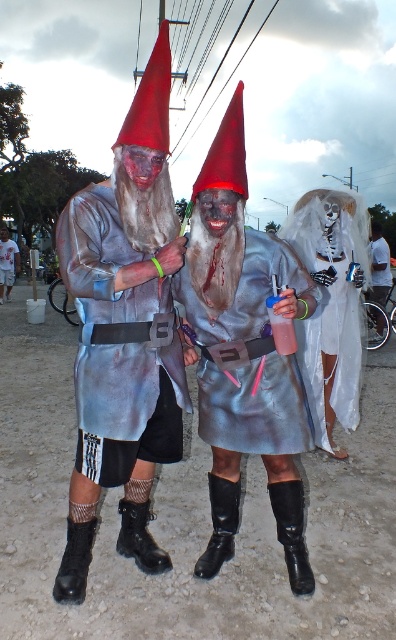
Question: Estimate the real-world distances between objects in this image. Which object is farther from the white sheer fabric ghost at center?

Choices:
 (A) matte silver costume at center
 (B) metallic silver costume at center
 (C) metallic silver dress at center
 (D) brushed silver robe at center

Answer: (B)

Question: Is brushed silver robe at center smaller than metallic silver dress at center?

Choices:
 (A) no
 (B) yes

Answer: (A)

Question: Among these points, which one is nearest to the camera?

Choices:
 (A) (260, 298)
 (B) (375, 280)
 (C) (356, 291)

Answer: (A)

Question: Among these points, which one is nearest to the camera?

Choices:
 (A) (373, 312)
 (B) (302, 275)
 (C) (234, 420)

Answer: (B)

Question: Can you confirm if brushed silver robe at center is thinner than white sheer fabric ghost at center?

Choices:
 (A) no
 (B) yes

Answer: (B)

Question: Is matte silver costume at center wider than white sheer fabric ghost at center?

Choices:
 (A) no
 (B) yes

Answer: (A)